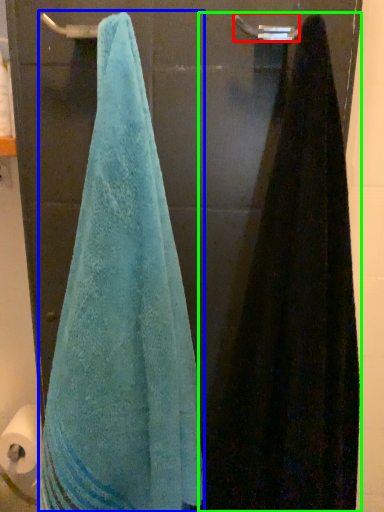
Question: Considering the real-world distances, which object is farthest from towel bar (highlighted by a red box)? towel (highlighted by a blue box) or towel (highlighted by a green box)?

Choices:
 (A) towel
 (B) towel

Answer: (A)